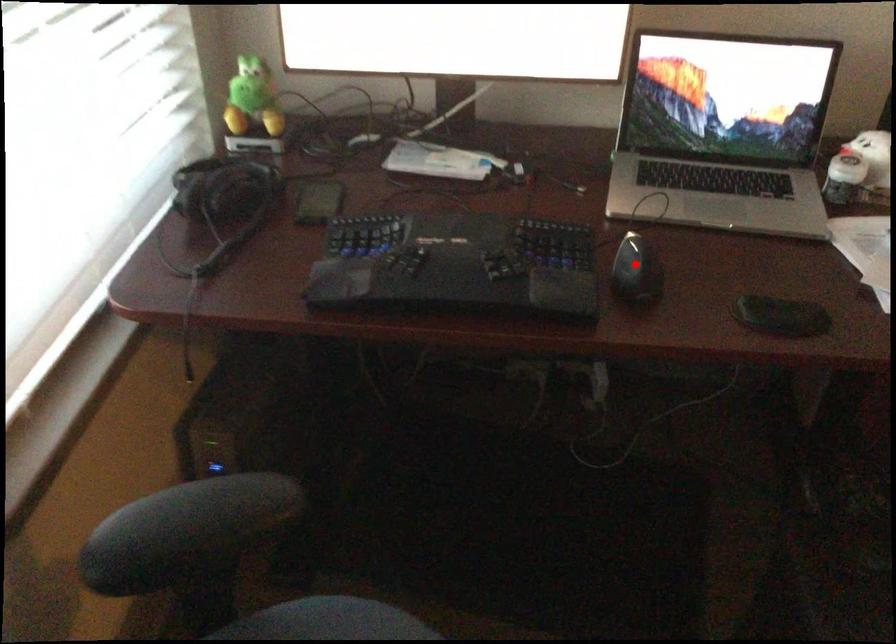
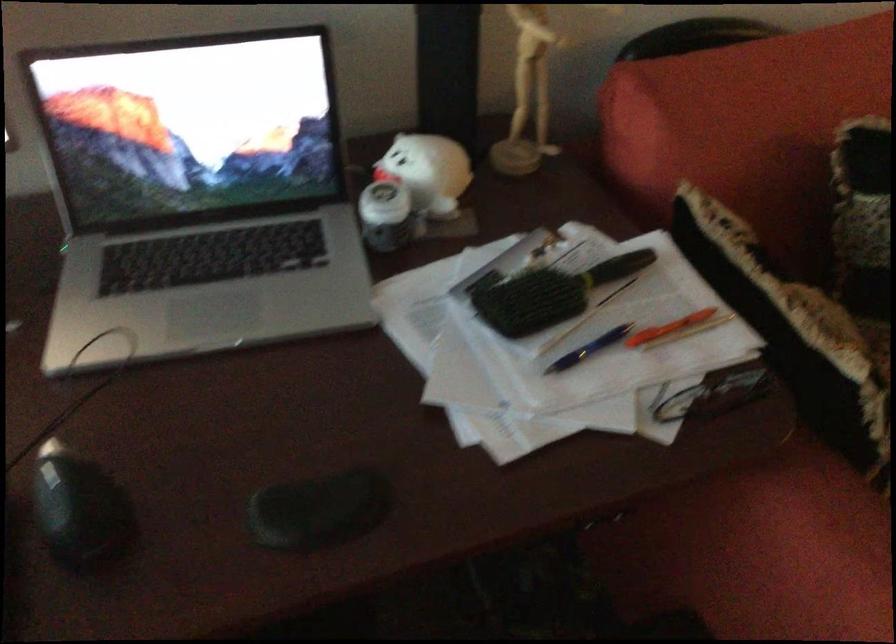
Question: I am providing you with two images of the same scene from different viewpoints. In image1, a red point is highlighted. Considering the same 3D point in image2, which of the following is correct?

Choices:
 (A) It is closer
 (B) It is farther

Answer: (A)